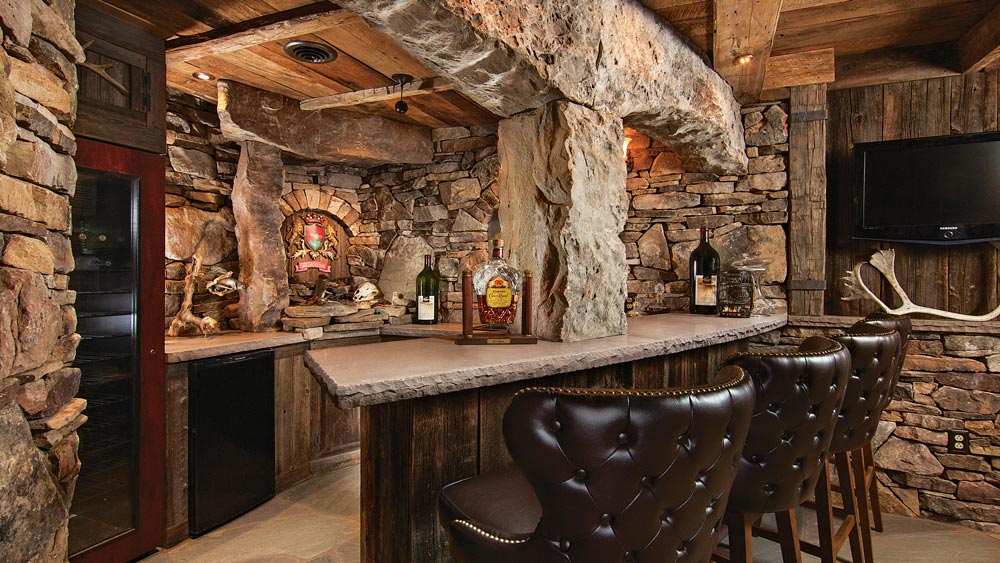
The width and height of the screenshot is (1000, 563). I want to click on tv, so click(921, 196).